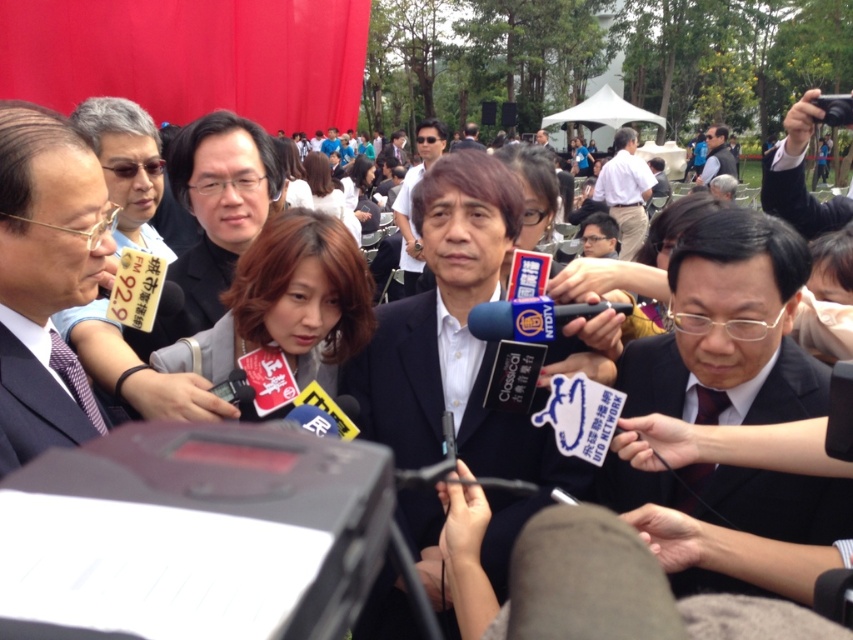
Who is lower down, dark suit at center or dark gray suit at upper right?

Positioned lower is dark suit at center.

Who is higher up, dark suit at center or dark gray suit at upper right?

dark gray suit at upper right is above.

Does point (412, 275) come farther from viewer compared to point (721, 154)?

No, it is in front of (721, 154).

Where is `dark suit at center`? dark suit at center is located at coordinates pyautogui.click(x=410, y=200).

Who is positioned more to the right, white shirt at center or dark blue suit at left?

white shirt at center is more to the right.

Is white shirt at center further to the viewer compared to dark blue suit at left?

Yes, it is.

Is point (627, 180) in front of point (88, 420)?

No, it is not.

Where is `white shirt at center`? The width and height of the screenshot is (853, 640). white shirt at center is located at coordinates (625, 189).

Does matte black suit at center appear on the left side of white shirt at center?

Indeed, matte black suit at center is positioned on the left side of white shirt at center.

Is point (229, 259) farther from viewer compared to point (618, 221)?

No, (229, 259) is in front of (618, 221).

Identify the location of matte black suit at center. (218, 208).